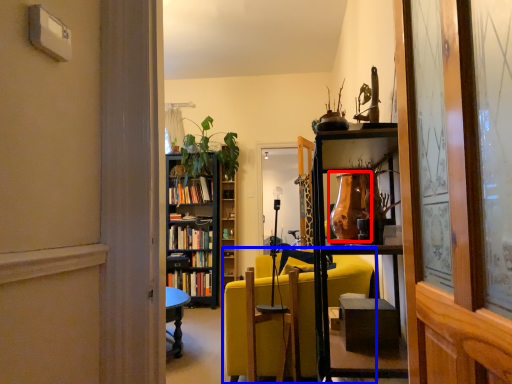
Question: Which object appears farthest to the camera in this image, glass vase (highlighted by a red box) or studio couch (highlighted by a blue box)?

Choices:
 (A) glass vase
 (B) studio couch

Answer: (B)